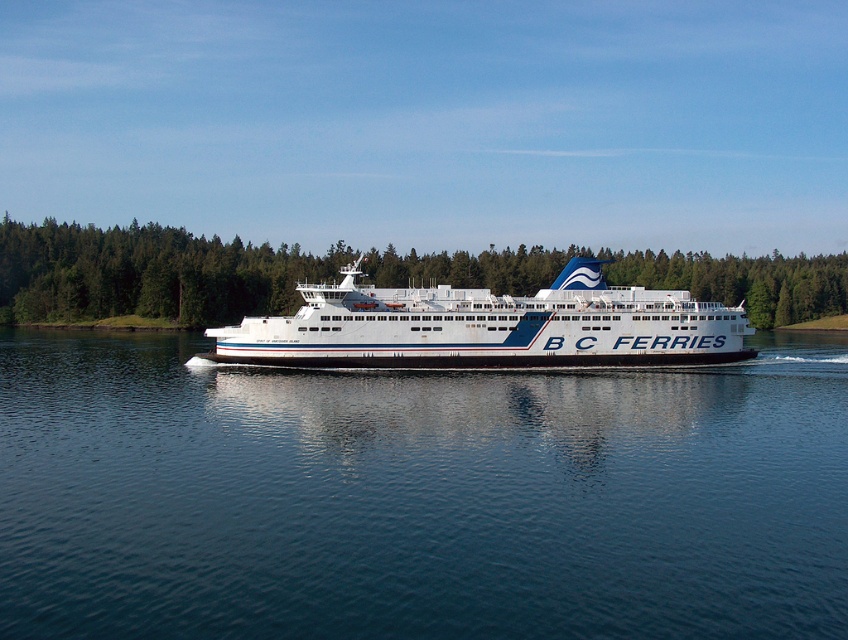
Question: Is blue water at center thinner than white glossy ferry at center?

Choices:
 (A) yes
 (B) no

Answer: (B)

Question: Based on their relative distances, which object is nearer to the blue water at center?

Choices:
 (A) green leafy forest at center
 (B) white glossy ferry at center

Answer: (B)

Question: Which object appears farthest from the camera in this image?

Choices:
 (A) green leafy forest at center
 (B) blue water at center

Answer: (A)

Question: Considering the real-world distances, which object is farthest from the green leafy forest at center?

Choices:
 (A) white glossy ferry at center
 (B) blue water at center

Answer: (B)

Question: Can you confirm if blue water at center is positioned above white glossy ferry at center?

Choices:
 (A) yes
 (B) no

Answer: (B)

Question: Can you confirm if blue water at center is thinner than white glossy ferry at center?

Choices:
 (A) yes
 (B) no

Answer: (B)